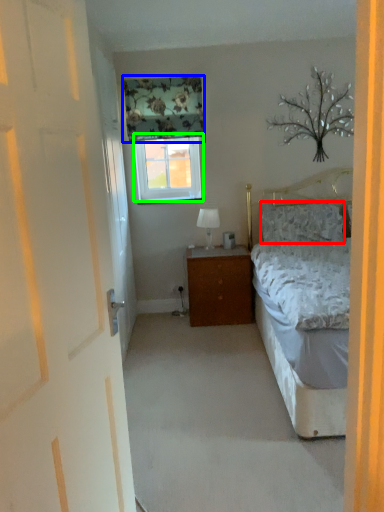
Question: Based on their relative distances, which object is nearer to pillow (highlighted by a red box)? Choose from curtain (highlighted by a blue box) and window (highlighted by a green box).

Choices:
 (A) curtain
 (B) window

Answer: (B)